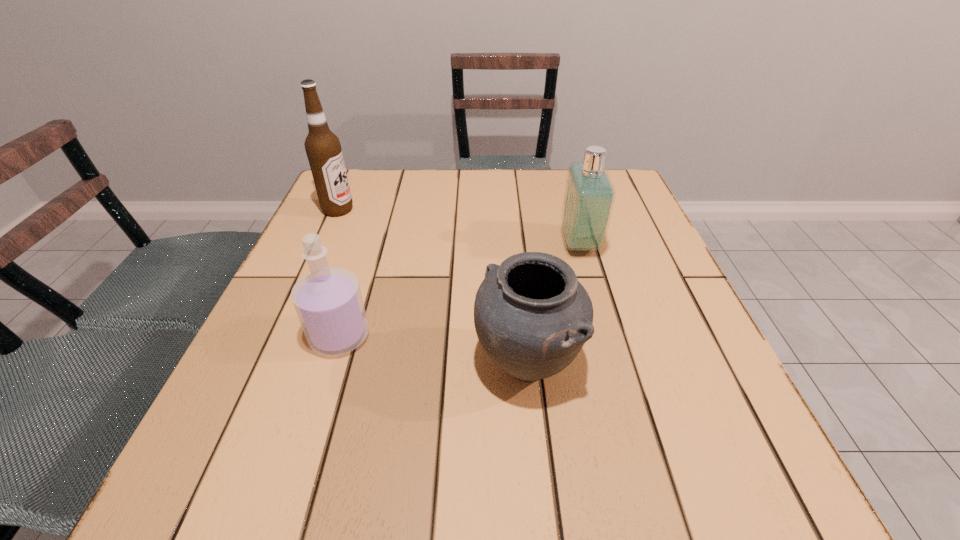
Locate which object ranks second in proximity to the third object from left to right. Please provide its 2D coordinates. Your answer should be formatted as a tuple, i.e. [(x, y)], where the tuple contains the x and y coordinates of a point satisfying the conditions above.

[(328, 301)]

Select which object is the closest to the second object from right to left. Please provide its 2D coordinates. Your answer should be formatted as a tuple, i.e. [(x, y)], where the tuple contains the x and y coordinates of a point satisfying the conditions above.

[(589, 196)]

Where is `blank space that satisfies the following two spatial constraints: 1. on the label of the tallest object; 2. on the back side of the second object from right to left`? This screenshot has width=960, height=540. blank space that satisfies the following two spatial constraints: 1. on the label of the tallest object; 2. on the back side of the second object from right to left is located at coordinates (269, 364).

Where is `vacant space that satisfies the following two spatial constraints: 1. on the front side of the second object from right to left; 2. on the left side of the left perfume`? The height and width of the screenshot is (540, 960). vacant space that satisfies the following two spatial constraints: 1. on the front side of the second object from right to left; 2. on the left side of the left perfume is located at coordinates (331, 364).